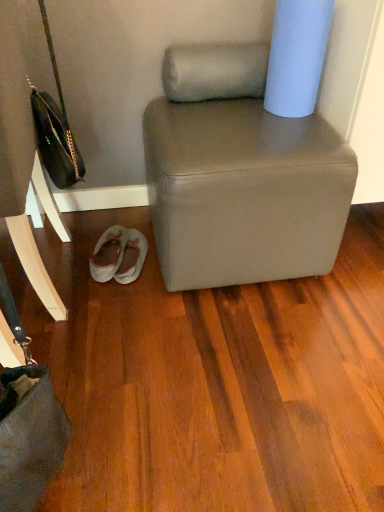
Identify the location of free area in between matte gray ottoman at center and light gray suede slippers at lower left. Image resolution: width=384 pixels, height=512 pixels. (132, 231).